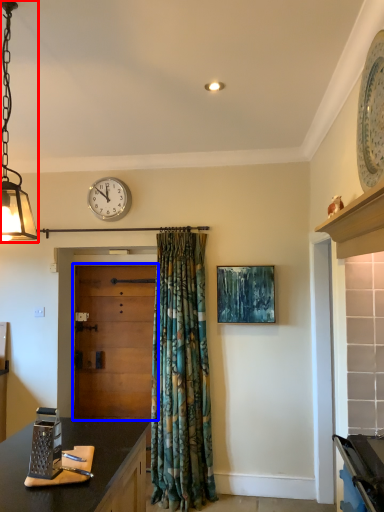
Question: Which of the following is the farthest to the observer, lamp (highlighted by a red box) or door (highlighted by a blue box)?

Choices:
 (A) lamp
 (B) door

Answer: (B)